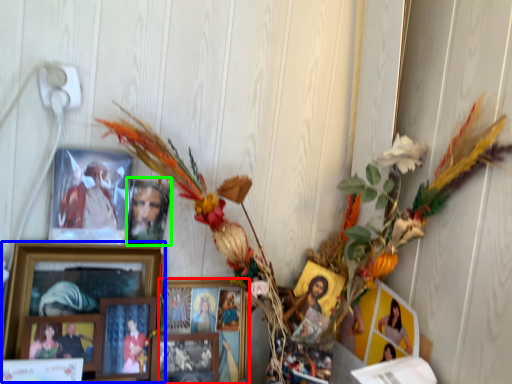
Question: Which object is the farthest from picture frame (highlighted by a red box)? Choose among these: picture frame (highlighted by a blue box) or picture frame (highlighted by a green box).

Choices:
 (A) picture frame
 (B) picture frame

Answer: (B)